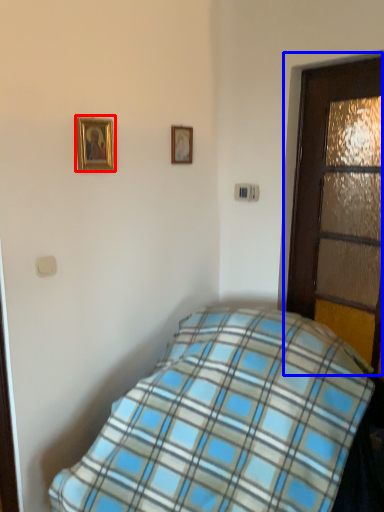
Question: Which object is closer to the camera taking this photo, picture frame (highlighted by a red box) or door (highlighted by a blue box)?

Choices:
 (A) picture frame
 (B) door

Answer: (B)